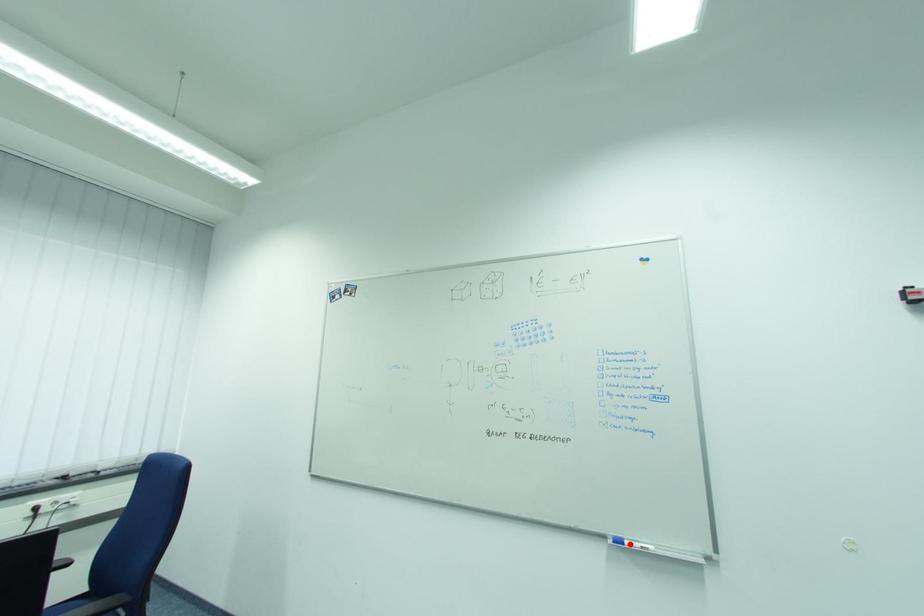
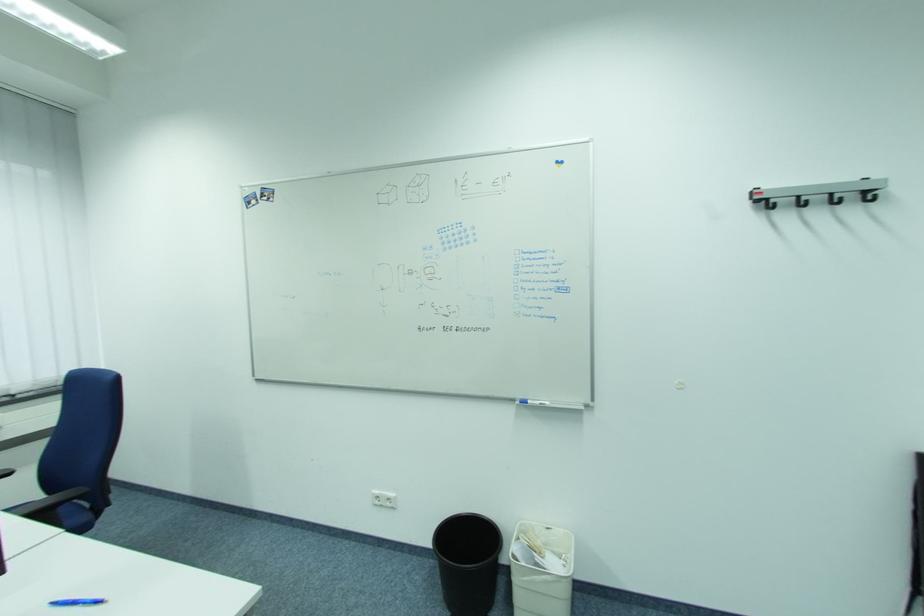
Find the pixel in the second image that matches the highlighted location in the first image.

(533, 403)